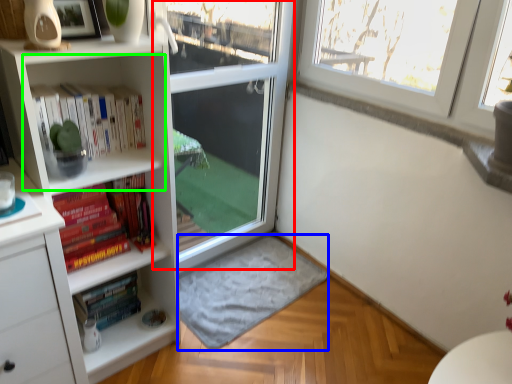
Question: Estimate the real-world distances between objects in this image. Which object is closer to screen door (highlighted by a red box), wide (highlighted by a blue box) or cabinet (highlighted by a green box)?

Choices:
 (A) wide
 (B) cabinet

Answer: (A)